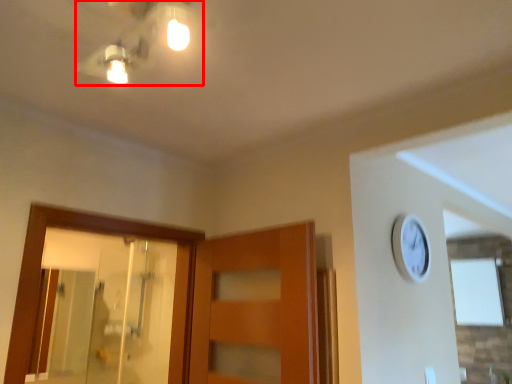
Question: From the image's perspective, what is the correct spatial relationship of light fixture (annotated by the red box) in relation to mirror?

Choices:
 (A) above
 (B) below

Answer: (A)